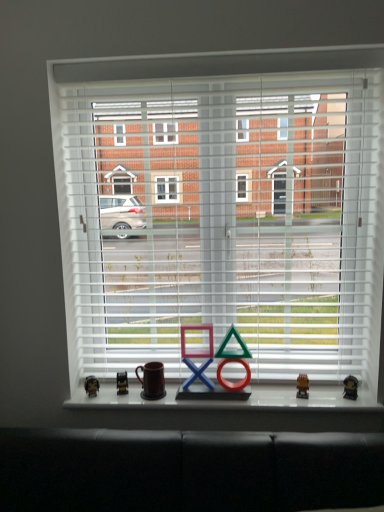
Question: Is metallic gold figurine at center, acting as the 3th miniature starting from the left, completely or partially outside of white matte blinds at center?

Choices:
 (A) no
 (B) yes

Answer: (B)

Question: Considering the relative sizes of metallic gold figurine at center, which is counted as the 2th miniature, starting from the right, and white matte blinds at center in the image provided, is metallic gold figurine at center, which is counted as the 2th miniature, starting from the right, taller than white matte blinds at center?

Choices:
 (A) yes
 (B) no

Answer: (B)

Question: From a real-world perspective, is metallic gold figurine at center, acting as the 3th miniature starting from the left, located beneath white matte blinds at center?

Choices:
 (A) yes
 (B) no

Answer: (A)

Question: Could white matte blinds at center be considered to be inside metallic gold figurine at center, acting as the 3th miniature starting from the left?

Choices:
 (A) yes
 (B) no

Answer: (B)

Question: Is metallic gold figurine at center, which is counted as the 2th miniature, starting from the right, next to white matte blinds at center?

Choices:
 (A) yes
 (B) no

Answer: (B)

Question: Is metallic gold figurine at center, which is counted as the 2th miniature, starting from the right, thinner than white matte blinds at center?

Choices:
 (A) no
 (B) yes

Answer: (B)

Question: Is metallic gold figurine at center, acting as the 3th miniature starting from the left, shorter than metallic gold miniature at lower left, which appears as the second miniature when viewed from the left?

Choices:
 (A) yes
 (B) no

Answer: (A)

Question: Is metallic gold figurine at center, which is counted as the 2th miniature, starting from the right, positioned behind metallic gold miniature at lower left, which appears as the 3th miniature when viewed from the right?

Choices:
 (A) yes
 (B) no

Answer: (B)

Question: Would you say metallic gold figurine at center, acting as the 3th miniature starting from the left, is a long distance from metallic gold miniature at lower left, which appears as the second miniature when viewed from the left?

Choices:
 (A) yes
 (B) no

Answer: (B)

Question: Is metallic gold figurine at center, which is counted as the 2th miniature, starting from the right, positioned beyond the bounds of metallic gold miniature at lower left, which appears as the second miniature when viewed from the left?

Choices:
 (A) yes
 (B) no

Answer: (A)

Question: From a real-world perspective, is metallic gold figurine at center, which is counted as the 2th miniature, starting from the right, located beneath metallic gold miniature at lower left, which appears as the 3th miniature when viewed from the right?

Choices:
 (A) yes
 (B) no

Answer: (B)

Question: From the image's perspective, is metallic gold figurine at center, acting as the 3th miniature starting from the left, beneath metallic gold miniature at lower left, which appears as the 3th miniature when viewed from the right?

Choices:
 (A) no
 (B) yes

Answer: (A)

Question: Is white matte blinds at center positioned beyond the bounds of metallic gold figurine at right, the fourth miniature in the left-to-right sequence?

Choices:
 (A) no
 (B) yes

Answer: (B)